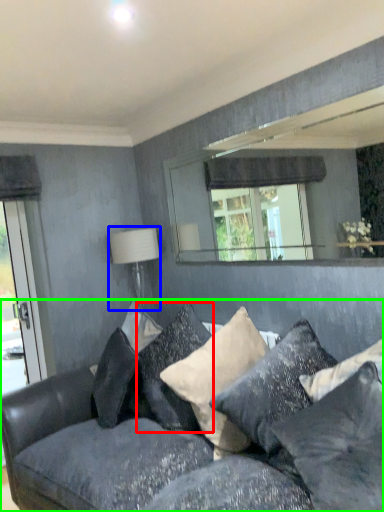
Question: Which object is positioned farthest from pillow (highlighted by a red box)? Select from table lamp (highlighted by a blue box) and studio couch (highlighted by a green box).

Choices:
 (A) table lamp
 (B) studio couch

Answer: (A)